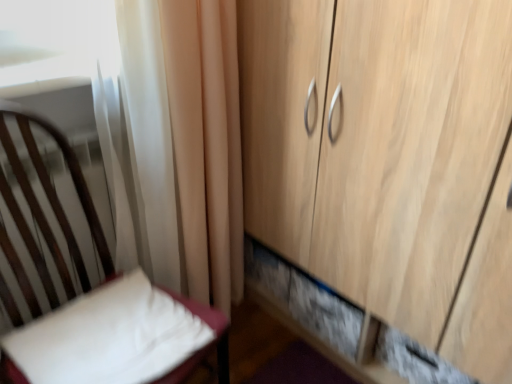
Question: Can you confirm if white soft pillow at lower left is thinner than wooden cupboard at right?

Choices:
 (A) yes
 (B) no

Answer: (A)

Question: Would you consider white soft pillow at lower left to be distant from wooden cupboard at right?

Choices:
 (A) no
 (B) yes

Answer: (A)

Question: Considering the relative positions of white soft pillow at lower left and wooden cupboard at right in the image provided, is white soft pillow at lower left to the right of wooden cupboard at right from the viewer's perspective?

Choices:
 (A) yes
 (B) no

Answer: (B)

Question: Could wooden cupboard at right be considered to be inside white soft pillow at lower left?

Choices:
 (A) no
 (B) yes

Answer: (A)

Question: Does white soft pillow at lower left have a larger size compared to wooden cupboard at right?

Choices:
 (A) yes
 (B) no

Answer: (B)

Question: From the image's perspective, relative to white fabric chair at left, is white sheer curtain at upper left above or below?

Choices:
 (A) above
 (B) below

Answer: (A)

Question: Is white sheer curtain at upper left bigger or smaller than white fabric chair at left?

Choices:
 (A) small
 (B) big

Answer: (A)

Question: Is white sheer curtain at upper left inside or outside of white fabric chair at left?

Choices:
 (A) inside
 (B) outside

Answer: (B)

Question: Is point (160, 238) closer or farther from the camera than point (70, 168)?

Choices:
 (A) farther
 (B) closer

Answer: (A)

Question: Considering the positions of white soft pillow at lower left and white fabric chair at left in the image, is white soft pillow at lower left wider or thinner than white fabric chair at left?

Choices:
 (A) thin
 (B) wide

Answer: (A)

Question: From their relative heights in the image, would you say white soft pillow at lower left is taller or shorter than white fabric chair at left?

Choices:
 (A) short
 (B) tall

Answer: (A)

Question: Does point (109, 380) appear closer or farther from the camera than point (97, 221)?

Choices:
 (A) closer
 (B) farther

Answer: (A)

Question: From the image's perspective, is white soft pillow at lower left positioned above or below white fabric chair at left?

Choices:
 (A) below
 (B) above

Answer: (A)

Question: In terms of size, does white sheer curtain at upper left appear bigger or smaller than white soft pillow at lower left?

Choices:
 (A) small
 (B) big

Answer: (B)

Question: Is point (141, 14) closer or farther from the camera than point (84, 377)?

Choices:
 (A) closer
 (B) farther

Answer: (B)